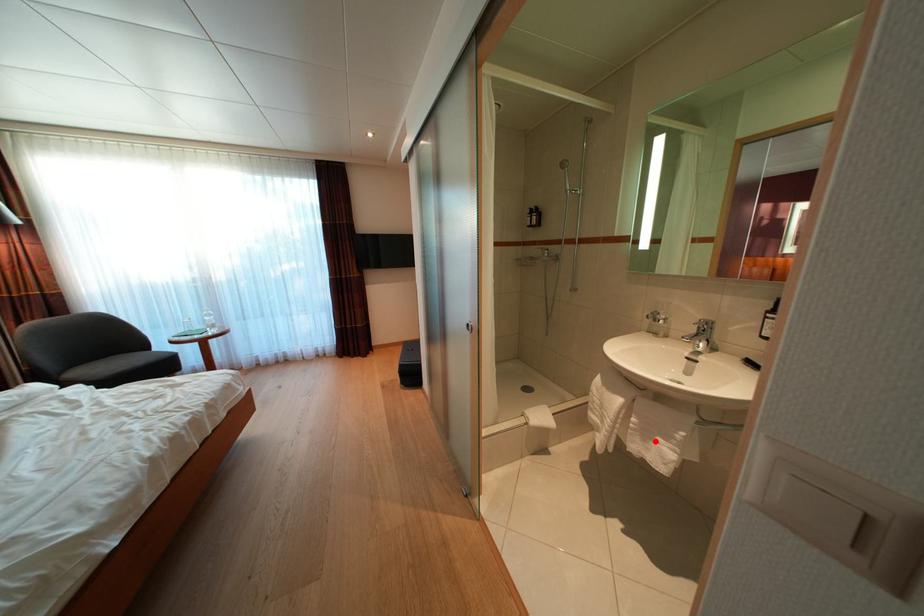
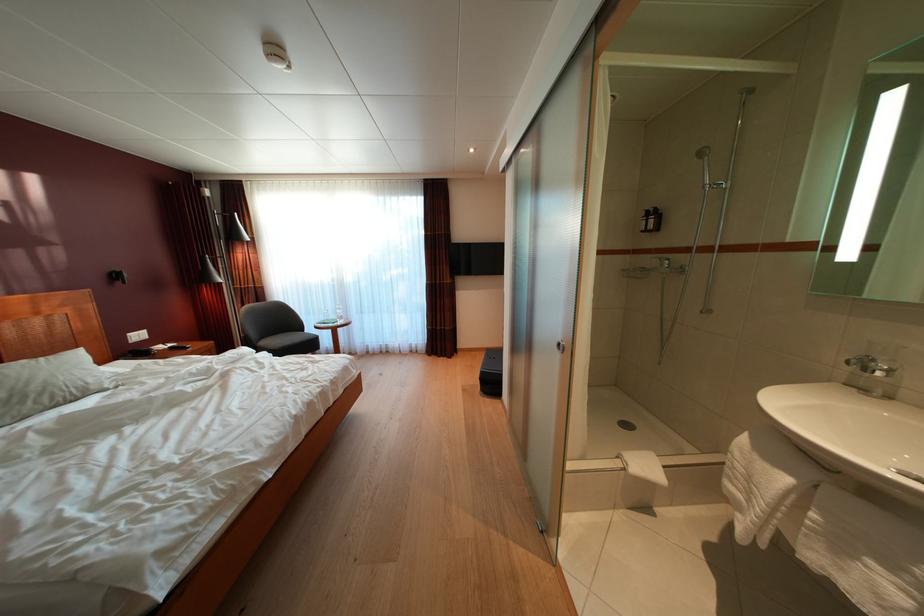
Question: I am providing you with two images of the same scene from different viewpoints. Image1 has a red point marked. In image2, the corresponding 3D location appears at what relative position? Reply with the corresponding letter.

Choices:
 (A) Closer
 (B) Farther

Answer: (A)